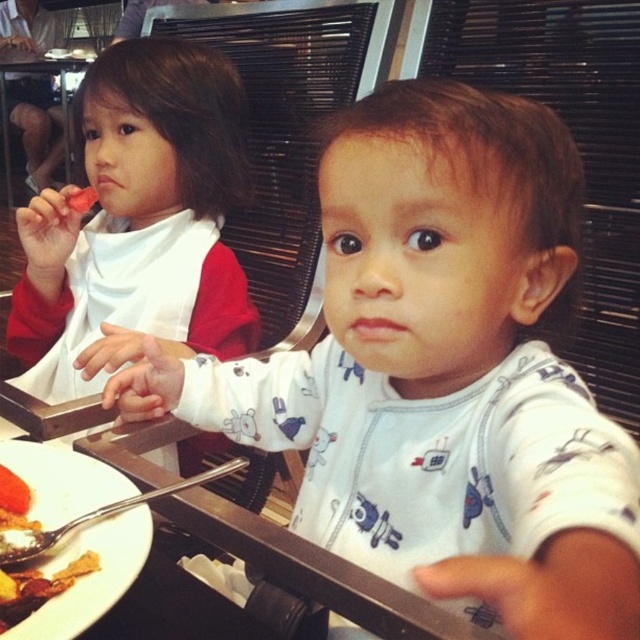
Question: Among these objects, which one is nearest to the camera?

Choices:
 (A) white matte bib at upper left
 (B) soft yellow bread at lower left

Answer: (B)

Question: Does white matte bib at upper left appear under soft yellow bread at lower left?

Choices:
 (A) yes
 (B) no

Answer: (B)

Question: Can you confirm if white matte bib at upper left is positioned below soft yellow bread at lower left?

Choices:
 (A) no
 (B) yes

Answer: (A)

Question: Can you confirm if white matte bib at upper left is bigger than soft yellow bread at lower left?

Choices:
 (A) yes
 (B) no

Answer: (A)

Question: Which point is closer to the camera?

Choices:
 (A) white matte bib at upper left
 (B) soft yellow bread at lower left

Answer: (B)